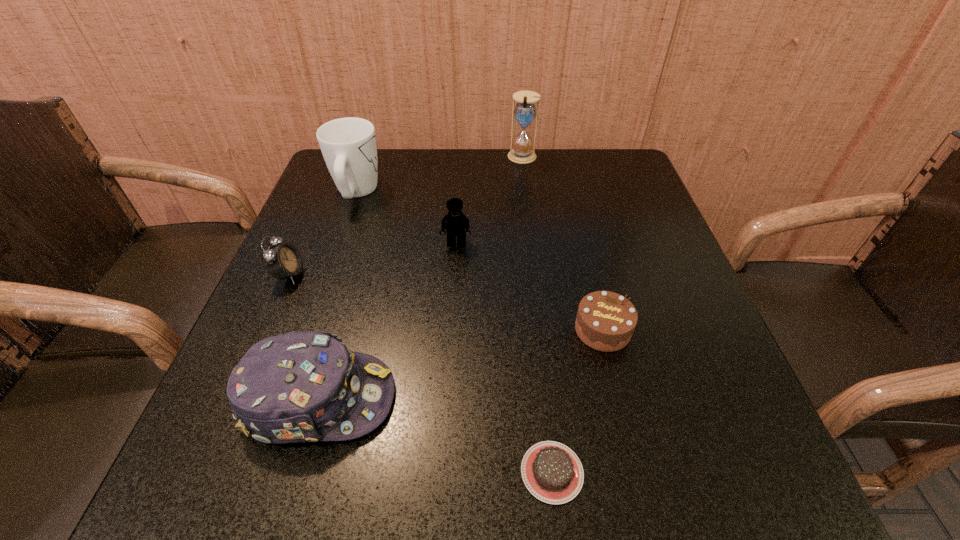
This screenshot has height=540, width=960. I want to click on the farther chocolate cake, so point(605,321).

Find the location of `the nearer chocolate cake`. the nearer chocolate cake is located at coordinates (552, 472).

Locate an element on the screen. the shortest object is located at coordinates (552, 472).

The width and height of the screenshot is (960, 540). I want to click on free location located 0.190m on the left of the tallest object, so click(x=439, y=158).

Where is `vacant space located 0.120m on the side of the sixth shortest object with the handle`? vacant space located 0.120m on the side of the sixth shortest object with the handle is located at coordinates (371, 150).

Identify the location of free space located 0.060m on the side of the sixth shortest object with the handle. The height and width of the screenshot is (540, 960). (367, 161).

Find the location of a particular element. Image resolution: width=960 pixels, height=540 pixels. vacant area located on the front-facing side of the fourth object from right to left is located at coordinates (453, 295).

The width and height of the screenshot is (960, 540). In order to click on vacant region located 0.200m on the front-facing side of the headwear in this screenshot , I will do `click(521, 399)`.

Where is `free space located 0.080m on the face of the fourth farthest object`? free space located 0.080m on the face of the fourth farthest object is located at coordinates (344, 275).

Where is `vacant position located 0.130m on the back of the taller chocolate cake`? The image size is (960, 540). vacant position located 0.130m on the back of the taller chocolate cake is located at coordinates (586, 261).